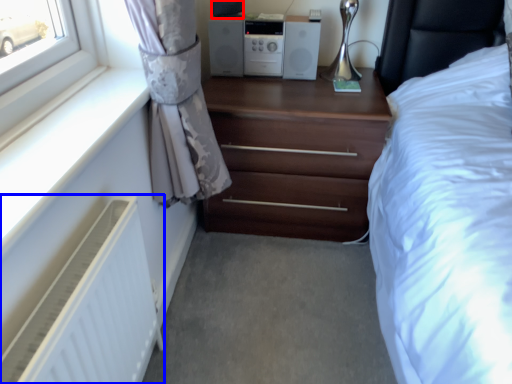
Question: Among these objects, which one is farthest to the camera, speaker (highlighted by a red box) or radiator (highlighted by a blue box)?

Choices:
 (A) speaker
 (B) radiator

Answer: (A)